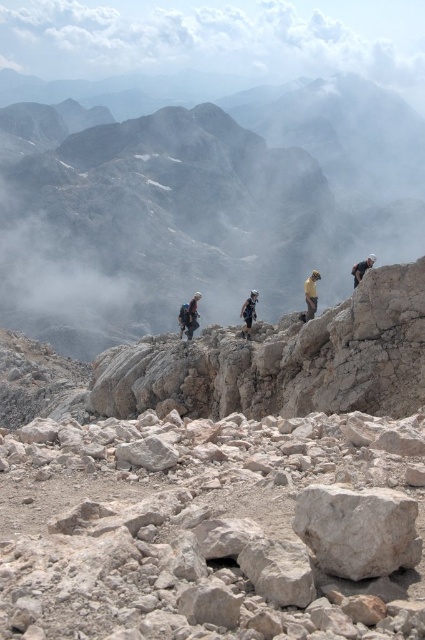
Question: Which of the following is the farthest from the observer?

Choices:
 (A) (360, 262)
 (B) (311, 301)
 (C) (357, 4)

Answer: (C)

Question: Where is rocky cliff at center located in relation to light brown fabric backpack at center in the image?

Choices:
 (A) right
 (B) left

Answer: (B)

Question: Is gray rough rock at center closer to camera compared to dark gray climbing gear at center?

Choices:
 (A) no
 (B) yes

Answer: (B)

Question: Is light brown fabric backpack at center above dark gray rock climber at upper right?

Choices:
 (A) yes
 (B) no

Answer: (B)

Question: Estimate the real-world distances between objects in this image. Which object is closer to the gray rough rock at center?

Choices:
 (A) white rough rock at center
 (B) dark gray rock climber at upper right
 (C) rocky cliff at center

Answer: (A)

Question: Which object is positioned closest to the light brown fabric backpack at center?

Choices:
 (A) rocky cliff at center
 (B) white fluffy cloud at upper center
 (C) white rough rock at center
 (D) gray rough rock at center

Answer: (C)